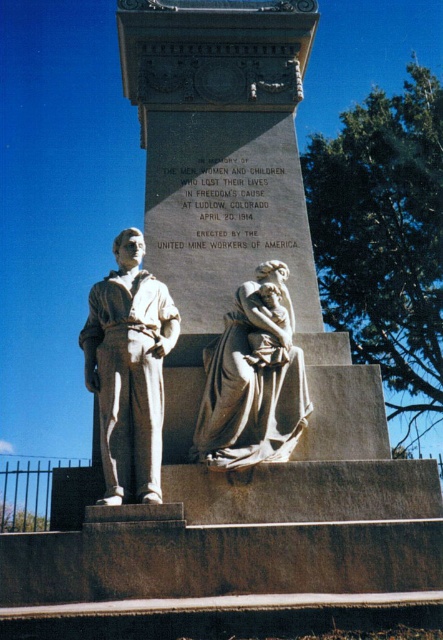
Based on the scene described, which object has a smaller width between the matte gray statue at left and the matte gray stone sculpture at center?

The matte gray statue at left has a lesser width compared to the matte gray stone sculpture at center.